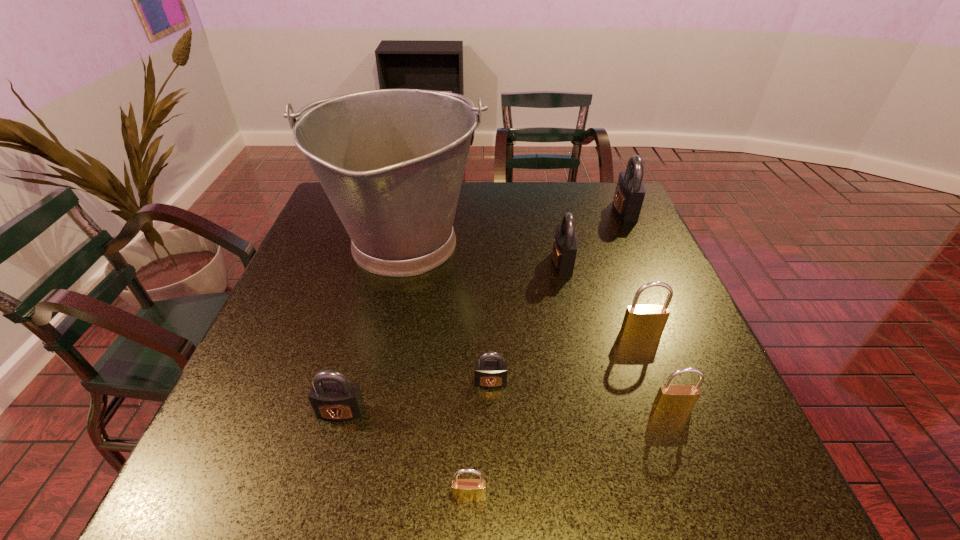
What are the coordinates of `the fourth nearest padlock` in the screenshot? It's located at (490, 374).

Identify the location of the fifth farthest object. (490, 374).

Where is `the smallest brass padlock`? This screenshot has height=540, width=960. the smallest brass padlock is located at coordinates (465, 490).

This screenshot has width=960, height=540. Find the location of `the nearest object`. the nearest object is located at coordinates (465, 490).

Where is `vacant space located on the back of the bucket`? This screenshot has height=540, width=960. vacant space located on the back of the bucket is located at coordinates (417, 186).

I want to click on vacant space located on the front of the rightmost gray padlock near the keyhole, so click(545, 211).

Find the location of `vacant region located on the front of the rightmost gray padlock near the keyhole`. vacant region located on the front of the rightmost gray padlock near the keyhole is located at coordinates (503, 211).

This screenshot has height=540, width=960. Identify the location of vacant space located on the front of the rightmost gray padlock near the keyhole. (492, 211).

In order to click on free spot located on the front of the second gray padlock from right to left near the keyhole in this screenshot , I will do `click(400, 263)`.

The image size is (960, 540). Identify the location of free space located on the front of the second gray padlock from right to left near the keyhole. (438, 263).